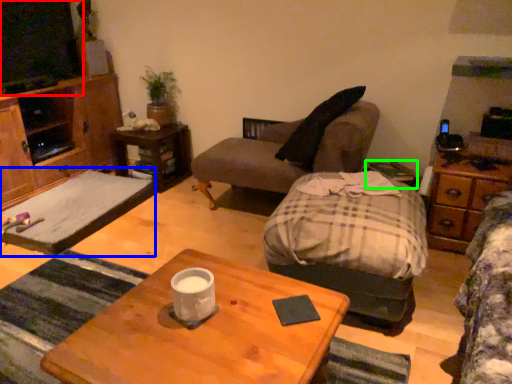
Question: Based on their relative distances, which object is farther from television (highlighted by a red box)? Choose from flat (highlighted by a blue box) and side table (highlighted by a green box).

Choices:
 (A) flat
 (B) side table

Answer: (B)